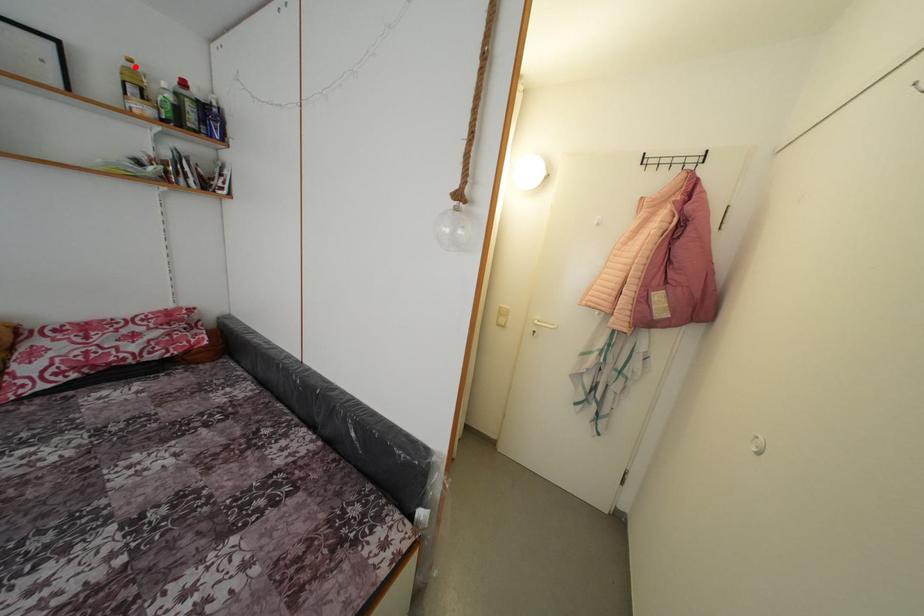
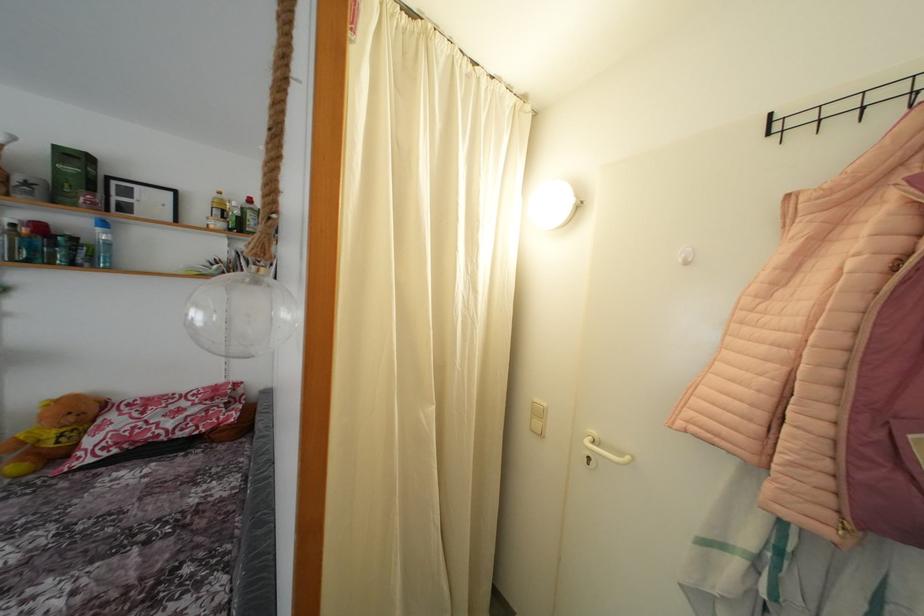
In the second image, find the point that corresponds to the highlighted location in the first image.

(225, 199)